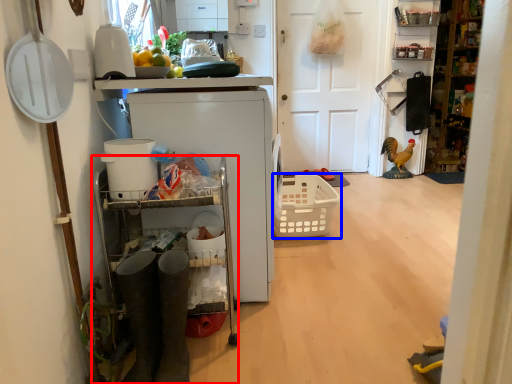
Question: Which object appears farthest to the camera in this image, cabinetry (highlighted by a red box) or basket (highlighted by a blue box)?

Choices:
 (A) cabinetry
 (B) basket

Answer: (B)